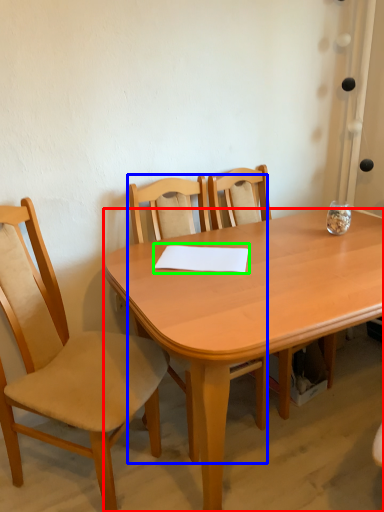
Question: Which object is positioned closest to desk (highlighted by a red box)? Select from chair (highlighted by a blue box) and notepad (highlighted by a green box).

Choices:
 (A) chair
 (B) notepad

Answer: (B)